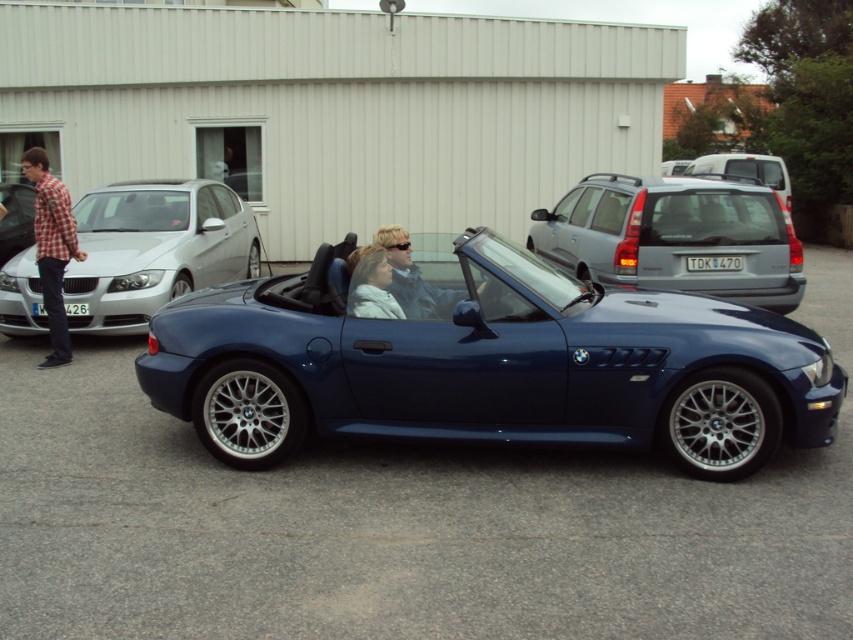
Question: Is shiny blue convertible at center smaller than satin silver suv at center?

Choices:
 (A) yes
 (B) no

Answer: (A)

Question: Where is checkered fabric shirt at left located in relation to matte black convertible at left in the image?

Choices:
 (A) right
 (B) left

Answer: (A)

Question: Which of these objects is positioned closest to the checkered fabric shirt at left?

Choices:
 (A) matte white jacket at center
 (B) matte silver sedan at left
 (C) satin silver suv at center

Answer: (B)

Question: Is checkered fabric shirt at left smaller than matte white jacket at center?

Choices:
 (A) yes
 (B) no

Answer: (B)

Question: Which object appears closest to the camera in this image?

Choices:
 (A) matte silver sedan at left
 (B) shiny blue convertible at center
 (C) matte white jacket at center

Answer: (B)

Question: Which of the following is the farthest from the observer?

Choices:
 (A) satin silver suv at center
 (B) matte silver sedan at left
 (C) shiny blue convertible at center
 (D) satin silver metallic station wagon at right

Answer: (B)